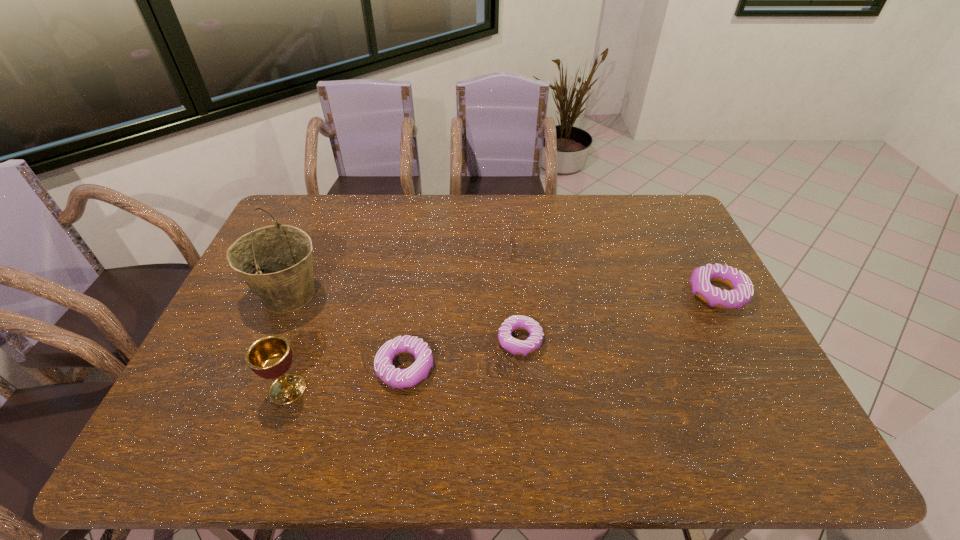
This screenshot has height=540, width=960. Identify the location of the fourth object from right to left. (394, 377).

Locate an element on the screen. Image resolution: width=960 pixels, height=540 pixels. the leftmost doughnut is located at coordinates (394, 377).

I want to click on the second doughnut from right to left, so click(x=514, y=346).

The height and width of the screenshot is (540, 960). I want to click on the shortest object, so click(514, 346).

Find the location of a particular element. The width and height of the screenshot is (960, 540). the farthest doughnut is located at coordinates point(742,290).

You are a GUI agent. You are given a task and a screenshot of the screen. Output one action in this format:
    pyautogui.click(x=<x>, y=<y>)
    Task: Click on the rightmost doughnut
    The width and height of the screenshot is (960, 540).
    Given the screenshot: What is the action you would take?
    pyautogui.click(x=742, y=290)

Locate an element on the screen. the farthest object is located at coordinates (510, 229).

What are the coordinates of `wine bucket` in the screenshot? It's located at (275, 261).

You are a GUI agent. You are given a task and a screenshot of the screen. Output one action in this format:
    pyautogui.click(x=<x>, y=<y>)
    Task: Click on the fifth shortest object
    
    Given the screenshot: What is the action you would take?
    pyautogui.click(x=270, y=357)

The height and width of the screenshot is (540, 960). Find the location of `vacant area located on the right of the fourth object from right to left`. vacant area located on the right of the fourth object from right to left is located at coordinates pyautogui.click(x=504, y=368).